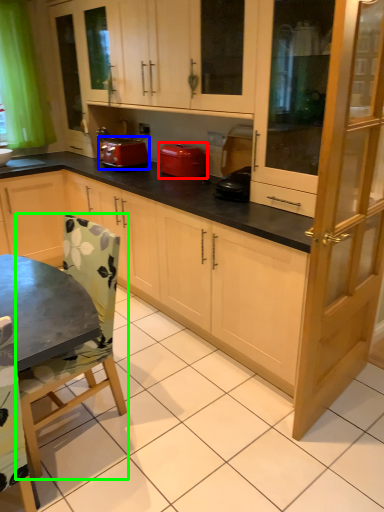
Question: Considering the real-world distances, which object is closest to home appliance (highlighted by a red box)? kitchen appliance (highlighted by a blue box) or chair (highlighted by a green box).

Choices:
 (A) kitchen appliance
 (B) chair

Answer: (A)